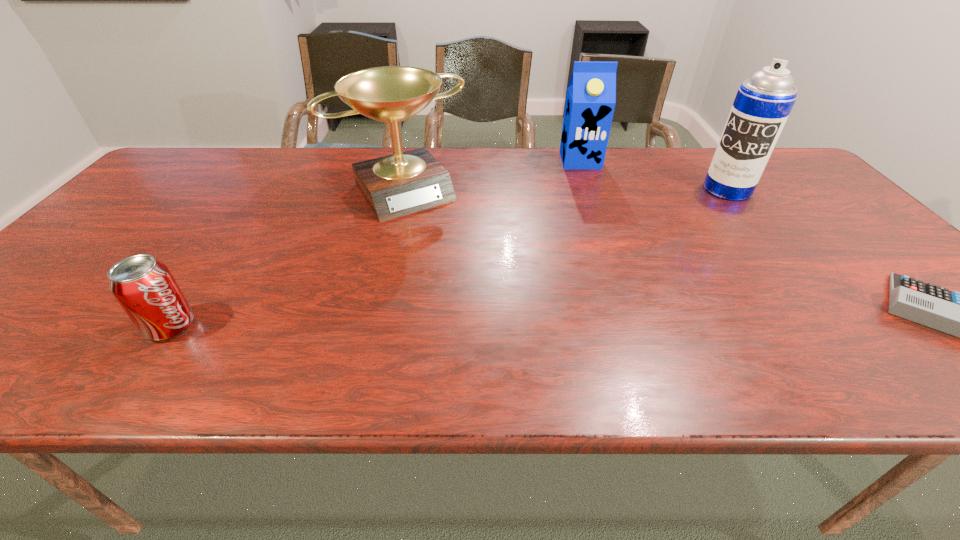
The height and width of the screenshot is (540, 960). In the image, there is a desktop. In order to click on blank space at the far edge in this screenshot , I will do (477, 177).

This screenshot has width=960, height=540. Find the location of `free space at the left edge of the desktop`. free space at the left edge of the desktop is located at coordinates (96, 295).

Image resolution: width=960 pixels, height=540 pixels. Find the location of `free spot at the right edge of the desktop`. free spot at the right edge of the desktop is located at coordinates (824, 207).

Image resolution: width=960 pixels, height=540 pixels. Find the location of `unoccupied position between the carton and the tallest object`. unoccupied position between the carton and the tallest object is located at coordinates (654, 175).

Where is `free spot between the aerosol can and the third object from right to left`? The image size is (960, 540). free spot between the aerosol can and the third object from right to left is located at coordinates (654, 175).

Find the location of a particular element. free space between the second object from left to right and the soda can is located at coordinates (286, 259).

Locate an element on the screen. empty space that is in between the leftmost object and the award is located at coordinates (286, 259).

In order to click on free area in between the tallest object and the carton in this screenshot , I will do `click(654, 175)`.

Locate which object is the closest to the third object from left to right. Please provide its 2D coordinates. Your answer should be formatted as a tuple, i.e. [(x, y)], where the tuple contains the x and y coordinates of a point satisfying the conditions above.

[(763, 103)]

Locate which object is the closest to the calculator. Please provide its 2D coordinates. Your answer should be formatted as a tuple, i.e. [(x, y)], where the tuple contains the x and y coordinates of a point satisfying the conditions above.

[(763, 103)]